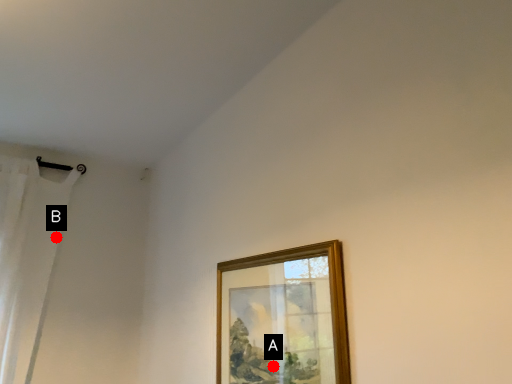
Question: Two points are circled on the image, labeled by A and B beside each circle. Which point is closer to the camera?

Choices:
 (A) A is closer
 (B) B is closer

Answer: (A)